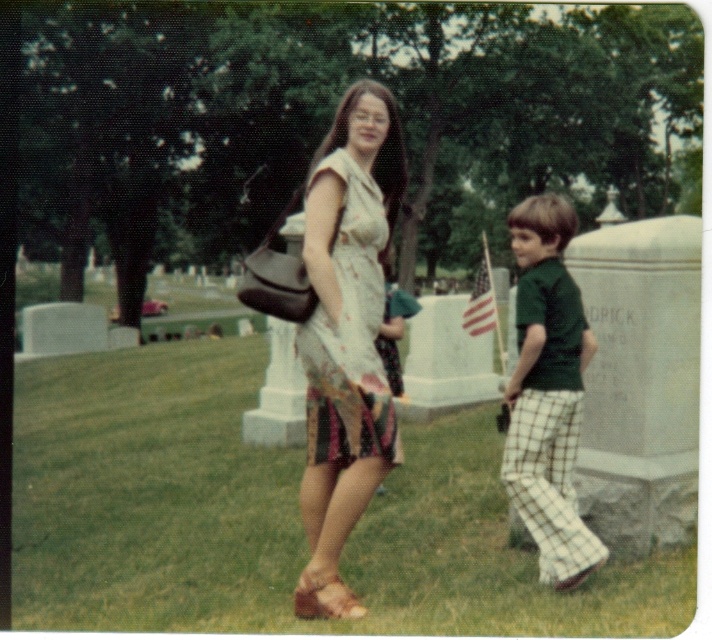
Question: Can you confirm if matte floral dress at center is bigger than printed fabric dress at center?

Choices:
 (A) no
 (B) yes

Answer: (A)

Question: Which is nearer to the matte floral dress at center?

Choices:
 (A) leather sandal at lower center
 (B) green grass at center
 (C) green textured shirt at right

Answer: (A)

Question: Based on their relative distances, which object is nearer to the green grass at center?

Choices:
 (A) green textured shirt at right
 (B) printed fabric dress at center
 (C) leather sandal at lower center
 (D) matte floral dress at center

Answer: (C)

Question: Can you confirm if green textured shirt at right is wider than printed fabric dress at center?

Choices:
 (A) no
 (B) yes

Answer: (A)

Question: Does printed fabric dress at center have a larger size compared to leather sandal at lower center?

Choices:
 (A) yes
 (B) no

Answer: (A)

Question: Considering the real-world distances, which object is farthest from the leather sandal at lower center?

Choices:
 (A) green grass at center
 (B) matte floral dress at center

Answer: (A)